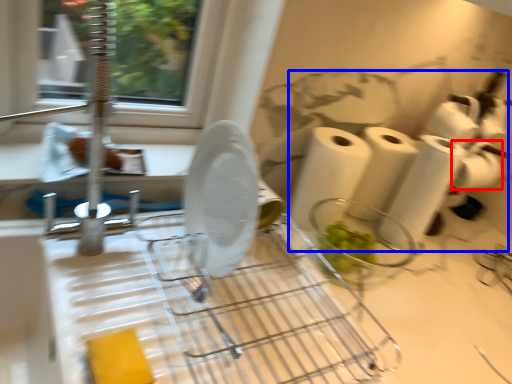
Question: Which object appears farthest to the camera in this image, toilet paper (highlighted by a red box) or toilet paper (highlighted by a blue box)?

Choices:
 (A) toilet paper
 (B) toilet paper

Answer: (A)